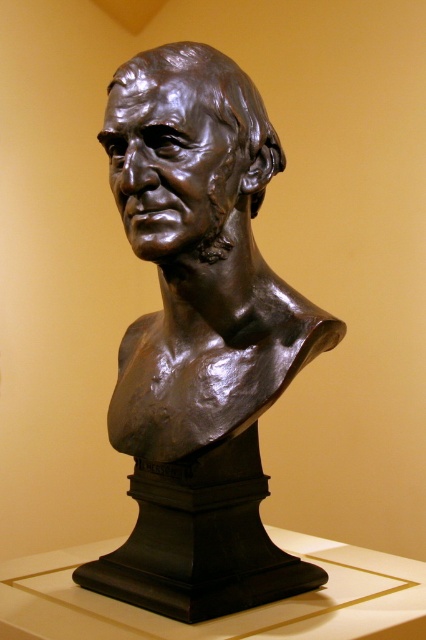
In the scene shown: You are standing in front of the bronze bust sculpture and notice two points marked on the sculpture. The first point is at coordinate point(244, 432) and the second is at point(143, 120). Which point is closer to you?

Point(244, 432) is closer to you because it is further to the viewer than point(143, 120).